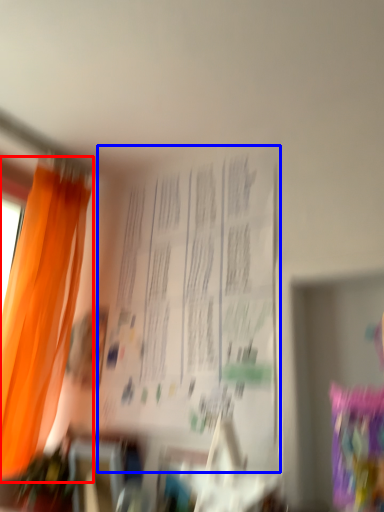
Question: Which object appears closest to the camera in this image, curtain (highlighted by a red box) or bulletin board (highlighted by a blue box)?

Choices:
 (A) curtain
 (B) bulletin board

Answer: (B)